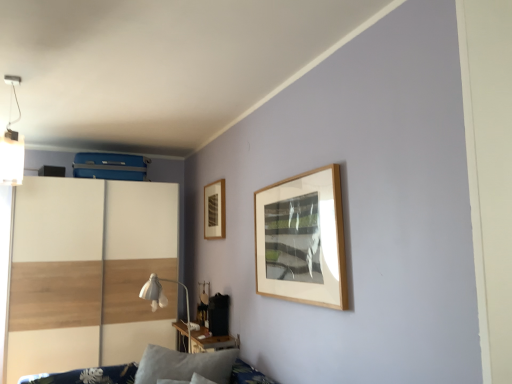
You are a GUI agent. You are given a task and a screenshot of the screen. Output one action in this format:
    pyautogui.click(x=<x>, y=<y>)
    Task: Click on the wooden picture frame at upper left
    
    Given the screenshot: What is the action you would take?
    pyautogui.click(x=214, y=210)

Locate an element on the screen. white fabric table lamp at center is located at coordinates (163, 298).

Measure the distance between white fabric table lamp at center and camera.

white fabric table lamp at center and camera are 3.21 meters apart from each other.

Image resolution: width=512 pixels, height=384 pixels. What do you see at coordinates (87, 376) in the screenshot?
I see `blue fabric sofa at lower left` at bounding box center [87, 376].

Measure the distance between point (11, 148) and camera.

Point (11, 148) and camera are 3.51 meters apart from each other.

Locate an element on the screen. Image resolution: width=512 pixels, height=384 pixels. wooden picture frame at upper left is located at coordinates (214, 210).

The image size is (512, 384). Find the location of `dresser on the left of gray fabric pillow at lower left`. dresser on the left of gray fabric pillow at lower left is located at coordinates (89, 272).

Is gray fabric pillow at lower left next to white wood dresser at left and touching it?

No, gray fabric pillow at lower left is not beside white wood dresser at left.

Is gray fabric pillow at lower left closer to camera compared to white wood dresser at left?

Yes, it is.

Is white matte light fixture at upper left turned away from gray fabric pillow at lower left?

No, white matte light fixture at upper left's orientation is not away from gray fabric pillow at lower left.

Is white matte light fixture at upper left to the left of gray fabric pillow at lower left from the viewer's perspective?

Yes.

Is white matte light fixture at upper left outside of gray fabric pillow at lower left?

white matte light fixture at upper left lies outside gray fabric pillow at lower left's area.

Considering the sizes of objects white wood dresser at left and wooden table at lower center in the image provided, who is thinner, white wood dresser at left or wooden table at lower center?

wooden table at lower center.

Which is behind, point (136, 222) or point (206, 341)?

The point (136, 222) is farther.

From the image's perspective, does white wood dresser at left appear higher than wooden table at lower center?

Indeed, from the image's perspective, white wood dresser at left is shown above wooden table at lower center.

From the picture: Is wooden picture frame at upper left facing towards white fabric table lamp at center?

No.

Are wooden picture frame at upper left and white fabric table lamp at center making contact?

There is a gap between wooden picture frame at upper left and white fabric table lamp at center.

From the image's perspective, is wooden picture frame at upper left located above or below white fabric table lamp at center?

wooden picture frame at upper left is above white fabric table lamp at center.

Does wooden picture frame at upper left turn towards white wood dresser at left?

No, wooden picture frame at upper left is not facing towards white wood dresser at left.

Which is in front, point (220, 186) or point (138, 353)?

The point (220, 186) is closer.

Would you say wooden picture frame at upper left is to the left or to the right of white wood dresser at left in the picture?

wooden picture frame at upper left is to the right of white wood dresser at left.

Considering the positions of objects wooden picture frame at upper left and blue fabric sofa at lower left in the image provided, who is more to the left, wooden picture frame at upper left or blue fabric sofa at lower left?

blue fabric sofa at lower left.

Is wooden picture frame at upper left next to blue fabric sofa at lower left?

There is a gap between wooden picture frame at upper left and blue fabric sofa at lower left.

Choose the correct answer: Is wooden picture frame at upper left inside blue fabric sofa at lower left or outside it?

The correct answer is: outside.

Looking at this image, from a real-world perspective, relative to blue fabric sofa at lower left, is wooden picture frame at upper left vertically above or below?

wooden picture frame at upper left is above blue fabric sofa at lower left.

From the image's perspective, which one is positioned higher, wooden table at lower center or blue fabric sofa at lower left?

wooden table at lower center.

Can you confirm if wooden table at lower center is positioned to the right of blue fabric sofa at lower left?

Yes.

Can you confirm if wooden table at lower center is shorter than blue fabric sofa at lower left?

Yes.

Is wooden table at lower center touching blue fabric sofa at lower left?

wooden table at lower center is not next to blue fabric sofa at lower left, and they're not touching.

You are a GUI agent. You are given a task and a screenshot of the screen. Output one action in this format:
    pyautogui.click(x=<x>, y=<y>)
    Task: Click on the pillow directly beneath the white wood dresser at left (from a real-world perspective)
    The height and width of the screenshot is (384, 512).
    Given the screenshot: What is the action you would take?
    pyautogui.click(x=184, y=365)

The height and width of the screenshot is (384, 512). There is a gray fabric pillow at lower left. Find the location of `light fixture above it (from a real-world perspective)`. light fixture above it (from a real-world perspective) is located at coordinates (12, 147).

Estimate the real-world distances between objects in this image. Which object is closer to gray fabric pillow at lower left, white wood dresser at left or wooden table at lower center?

wooden table at lower center lies closer to gray fabric pillow at lower left than the other object.

When comparing their distances from white fabric table lamp at center, does wooden table at lower center or white matte light fixture at upper left seem further?

white matte light fixture at upper left is further to white fabric table lamp at center.

From the image, which object appears to be farther from white matte light fixture at upper left, white fabric table lamp at center or blue fabric sofa at lower left?

The object further to white matte light fixture at upper left is blue fabric sofa at lower left.

Considering their positions, is white matte light fixture at upper left positioned closer to wooden table at lower center than blue fabric sofa at lower left?

Based on the image, blue fabric sofa at lower left appears to be nearer to wooden table at lower center.

Looking at the image, which one is located closer to white fabric table lamp at center, white matte light fixture at upper left or wooden picture frame at upper left?

wooden picture frame at upper left lies closer to white fabric table lamp at center than the other object.

Which object lies nearer to the anchor point wooden picture frame at upper left, blue fabric sofa at lower left or gray fabric pillow at lower left?

The object closer to wooden picture frame at upper left is gray fabric pillow at lower left.

Estimate the real-world distances between objects in this image. Which object is further from gray fabric pillow at lower left, white wood dresser at left or white matte light fixture at upper left?

white matte light fixture at upper left is positioned further to the anchor gray fabric pillow at lower left.

Considering their positions, is white fabric table lamp at center positioned closer to wooden picture frame at upper left than gray fabric pillow at lower left?

Based on the image, white fabric table lamp at center appears to be nearer to wooden picture frame at upper left.

You are a GUI agent. You are given a task and a screenshot of the screen. Output one action in this format:
    pyautogui.click(x=<x>, y=<y>)
    Task: Click on the table between blue fabric sofa at lower left and wooden picture frame at upper left from front to back
    The height and width of the screenshot is (384, 512).
    Given the screenshot: What is the action you would take?
    pyautogui.click(x=212, y=342)

Find the location of a particular element. light fixture between gray fabric pillow at lower left and wooden picture frame at upper left from front to back is located at coordinates (12, 147).

The height and width of the screenshot is (384, 512). In order to click on table lamp between white matte light fixture at upper left and blue fabric sofa at lower left from top to bottom in this screenshot , I will do `click(163, 298)`.

Where is `table lamp between gray fabric pillow at lower left and wooden picture frame at upper left in the front-back direction`? table lamp between gray fabric pillow at lower left and wooden picture frame at upper left in the front-back direction is located at coordinates (163, 298).